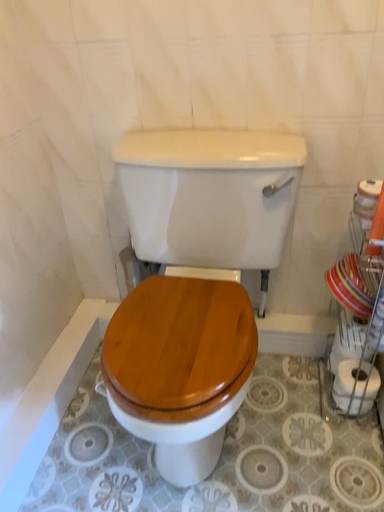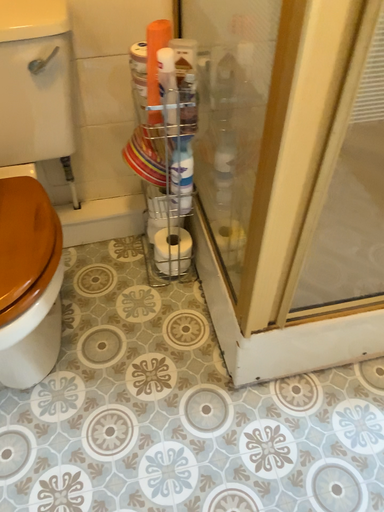
Question: How did the camera likely rotate when shooting the video?

Choices:
 (A) rotated upward
 (B) rotated downward

Answer: (B)